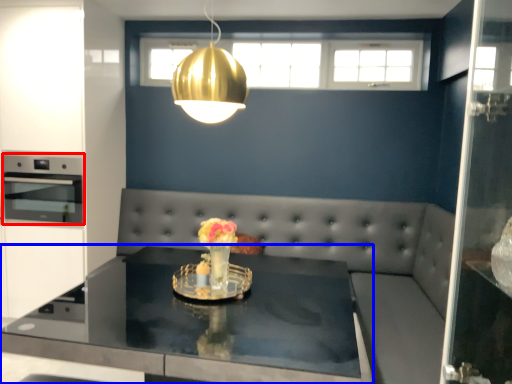
Question: Which of the following is the closest to the observer, appliance (highlighted by a red box) or table (highlighted by a blue box)?

Choices:
 (A) appliance
 (B) table

Answer: (B)